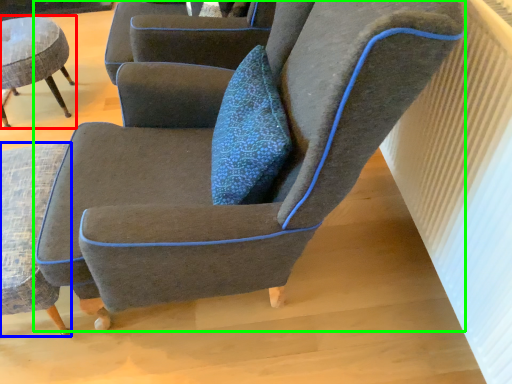
Question: Which object is positioned closest to chair (highlighted by a red box)? Select from chair (highlighted by a blue box) and chair (highlighted by a green box).

Choices:
 (A) chair
 (B) chair

Answer: (A)